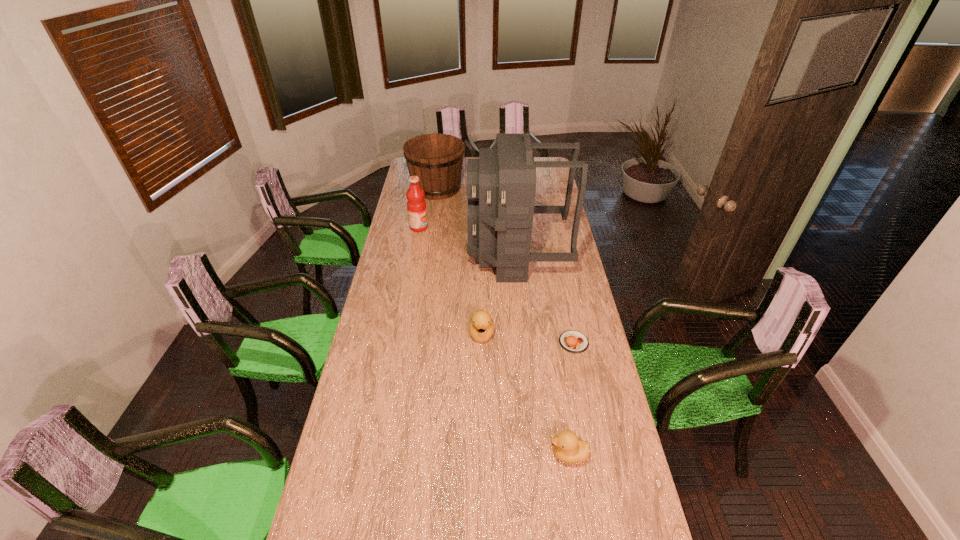
Find the location of `empty space between the tallest object and the patty (food)`. empty space between the tallest object and the patty (food) is located at coordinates (545, 299).

Locate an element on the screen. This screenshot has width=960, height=540. vacant space that's between the farthest object and the fruit juice is located at coordinates pos(428,208).

The width and height of the screenshot is (960, 540). I want to click on free space between the fruit juice and the farther duckling, so click(x=450, y=281).

Find the location of `vacant space that's between the fruit juice and the shorter duckling`. vacant space that's between the fruit juice and the shorter duckling is located at coordinates (493, 341).

Where is `free space between the fruit juice and the right duckling`? Image resolution: width=960 pixels, height=540 pixels. free space between the fruit juice and the right duckling is located at coordinates (493, 341).

Where is `free space between the farthest object and the shorter duckling`? free space between the farthest object and the shorter duckling is located at coordinates (503, 321).

At what (x,y) coordinates should I click in order to perform the action: click on vacant space that is in between the tallest object and the left duckling. Please return your answer as a coordinate pair (x, y). Image resolution: width=960 pixels, height=540 pixels. Looking at the image, I should click on (499, 294).

This screenshot has width=960, height=540. What are the coordinates of `empty space between the wine bucket and the taller duckling` in the screenshot? It's located at (459, 261).

This screenshot has width=960, height=540. In order to click on object that ranks as the fifth closest to the fruit juice in this screenshot , I will do `click(567, 448)`.

Select which object is the fourth closest to the backpack. Please provide its 2D coordinates. Your answer should be formatted as a tuple, i.e. [(x, y)], where the tuple contains the x and y coordinates of a point satisfying the conditions above.

[(572, 341)]